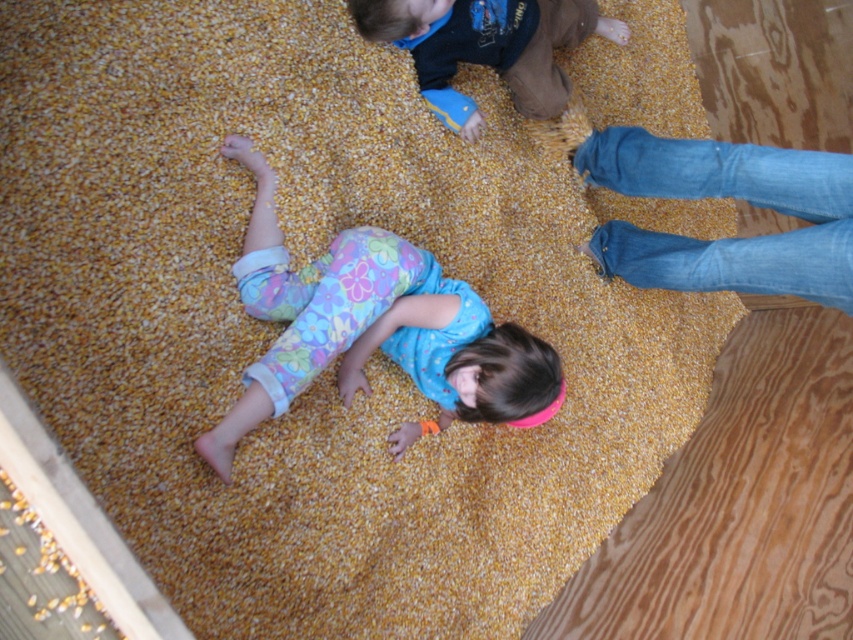
Question: Can you confirm if floral fabric toddler at center is positioned below dark blue shirt at upper center?

Choices:
 (A) yes
 (B) no

Answer: (A)

Question: Which point appears closest to the camera in this image?

Choices:
 (A) (254, 264)
 (B) (585, 13)

Answer: (A)

Question: Can you confirm if floral fabric toddler at center is positioned to the right of dark blue shirt at upper center?

Choices:
 (A) no
 (B) yes

Answer: (A)

Question: Which object is farther from the camera taking this photo?

Choices:
 (A) dark blue shirt at upper center
 (B) floral fabric toddler at center

Answer: (A)

Question: Which of the following is the farthest from the observer?

Choices:
 (A) floral fabric toddler at center
 (B) dark blue shirt at upper center

Answer: (B)

Question: Is floral fabric toddler at center to the left of dark blue shirt at upper center from the viewer's perspective?

Choices:
 (A) yes
 (B) no

Answer: (A)